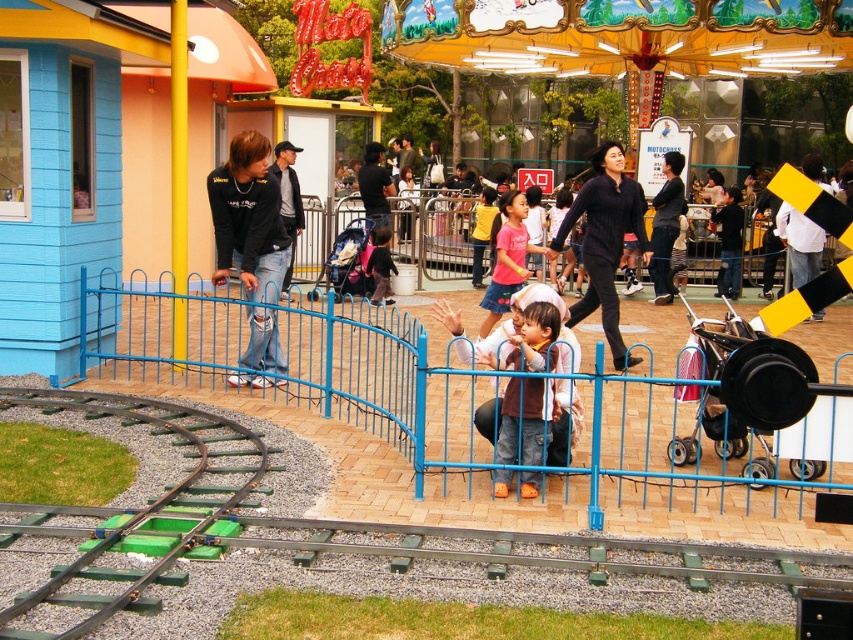
You are standing in the amusement park and see two points marked in the scene. Which point is closer to you, point (659, 275) or point (289, 209)?

Point (289, 209) is closer to you because it is less further than point (659, 275).